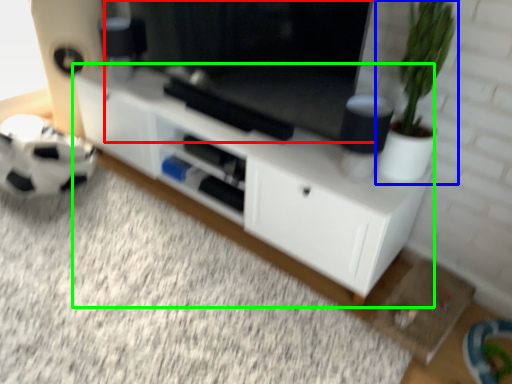
Question: Which object is positioned closest to window screen (highlighted by a red box)? Select from houseplant (highlighted by a blue box) and cabinetry (highlighted by a green box).

Choices:
 (A) houseplant
 (B) cabinetry

Answer: (B)